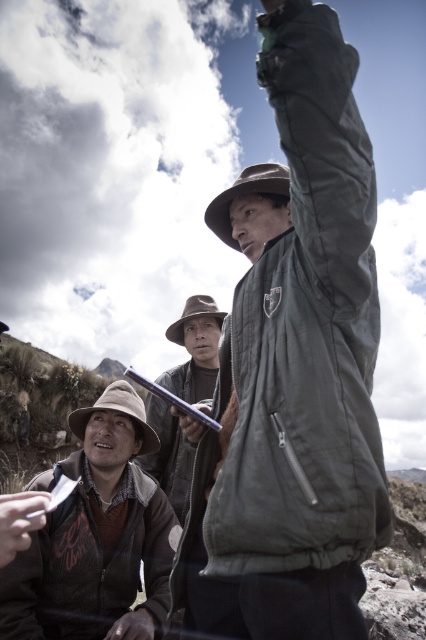
You are a photographer trying to capture a clear shot of both the green matte jacket at center and the white matte paper at lower left. Which object will appear larger in your photo?

The green matte jacket at center will appear larger in the photo because it is closer to the viewer than the white matte paper at lower left.

You are a photographer trying to capture a closeup of the brown felt cowboy hat at center without the leather glove at center appearing in the frame. Is this possible given their current positions?

The brown felt cowboy hat at center is positioned over the leather glove at center, so moving the camera slightly downward might allow you to frame the hat without the glove appearing in the shot.